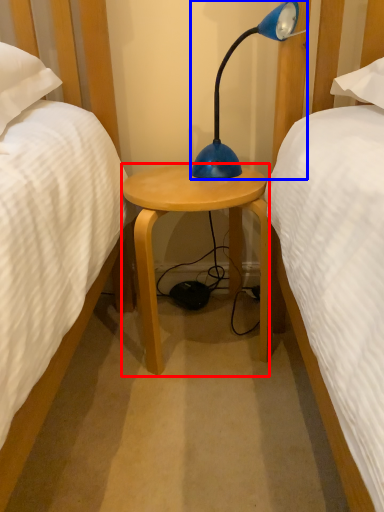
Question: Which object is closer to the camera taking this photo, stool (highlighted by a red box) or lamp (highlighted by a blue box)?

Choices:
 (A) stool
 (B) lamp

Answer: (B)